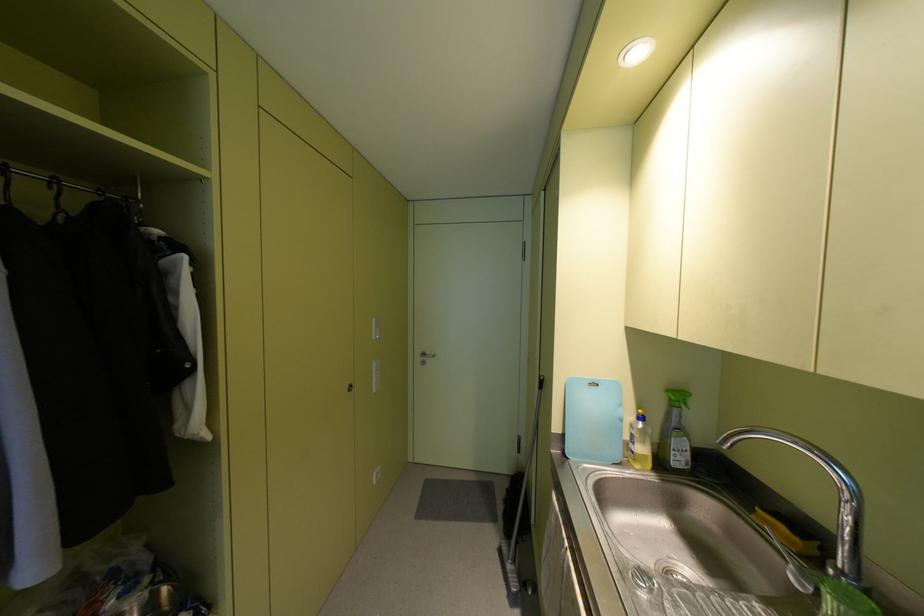
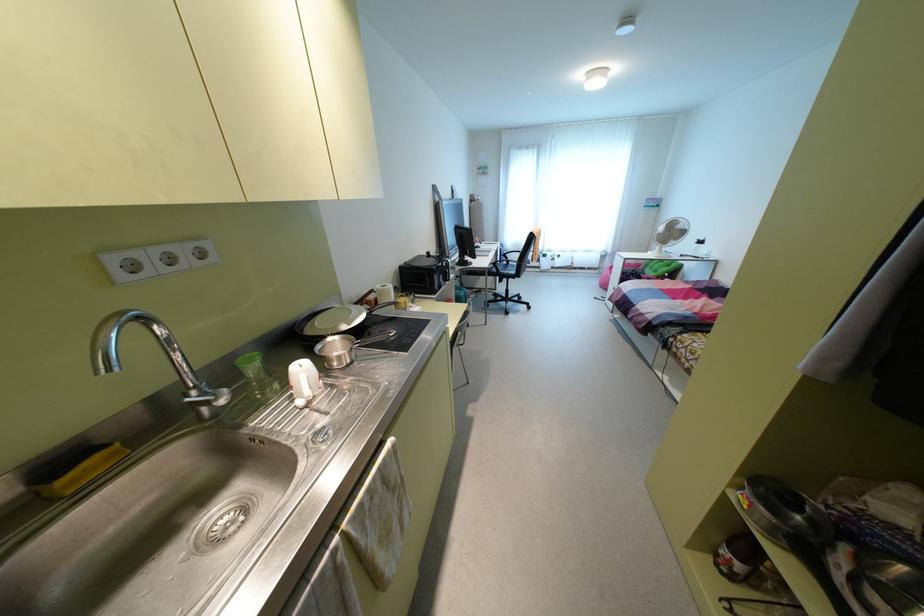
Where in the second image is the point corresponding to point 759,511 from the first image?

(59, 482)